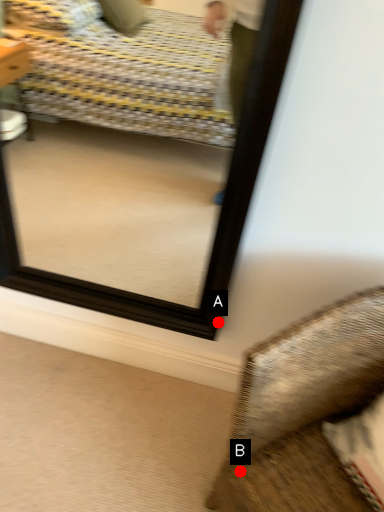
Question: Two points are circled on the image, labeled by A and B beside each circle. Which of the following is the farthest from the observer?

Choices:
 (A) A is further
 (B) B is further

Answer: (A)